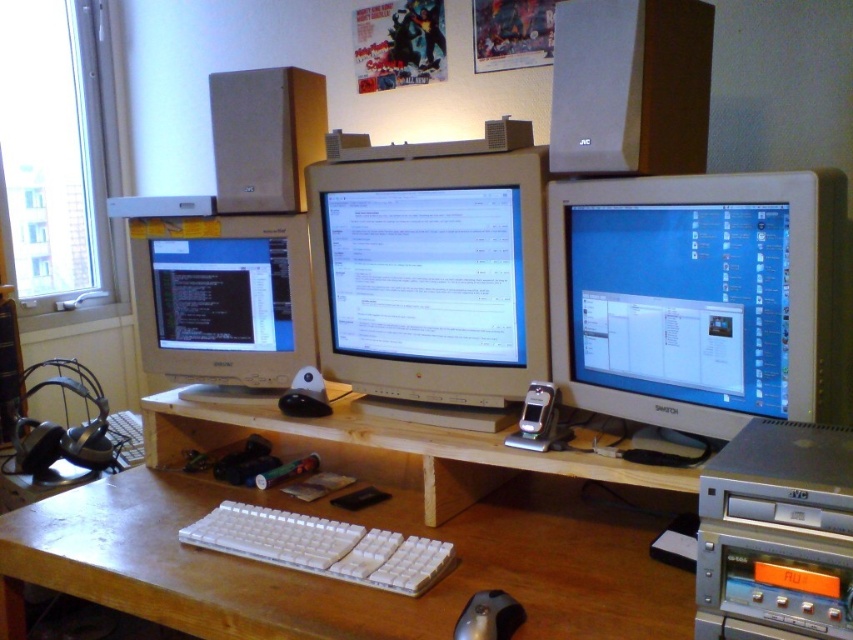
Based on the photo, you are setting up a new monitor on the desk and need to ensure it fits between the existing white glossy monitor at center right and the matte beige speaker at upper center. Given that the new monitor has a width of 18 inches, can you determine if there is enough space between them based on their widths?

The white glossy monitor at center right is wider than the matte beige speaker at upper center. Since the new monitor is 18 inches wide, you need to check if the space between them can accommodate this width. However, without knowing the exact distance between the two objects, we cannot confirm if there is enough space. Please measure the gap between them first.

You are sitting at the white wood computer desk at center and want to reach the white plastic keyboard at center. Can you easily reach it without moving your chair?

The white wood computer desk at center is closer to the viewer than the white plastic keyboard at center, so the keyboard is farther away. You might need to move your chair closer to reach it easily.

You are organizing your desk and want to place a new keyboard between the matte beige speaker at upper center and the silver metallic mouse at lower center. Based on their positions, which side of the keyboard should be closer to the speaker?

The matte beige speaker at upper center is to the left of the silver metallic mouse at lower center, so the left side of the keyboard should be closer to the speaker.